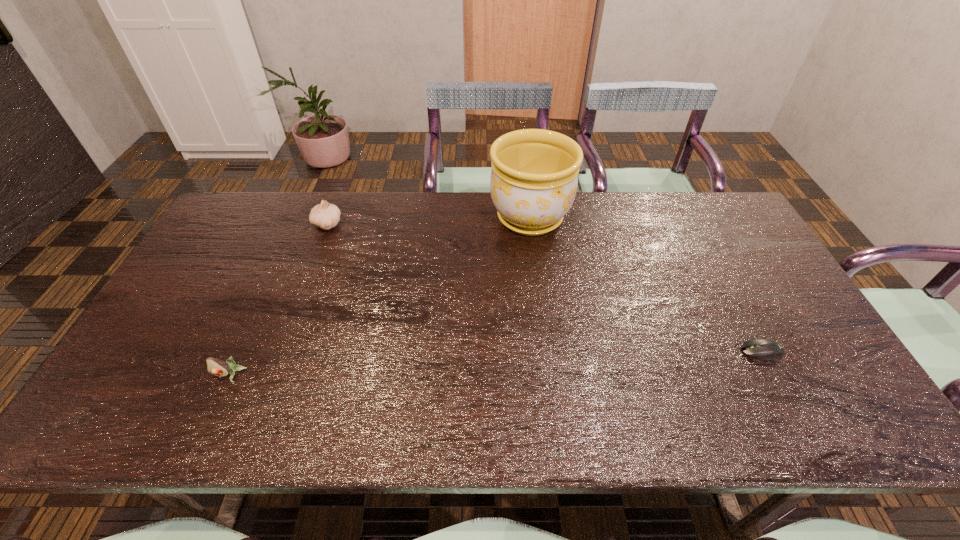
This screenshot has width=960, height=540. What are the coordinates of `the second object from right to left` in the screenshot? It's located at (534, 177).

Locate an element on the screen. flowerpot is located at coordinates (534, 177).

Locate an element on the screen. The height and width of the screenshot is (540, 960). garlic is located at coordinates (325, 215).

Image resolution: width=960 pixels, height=540 pixels. I want to click on the nearest object, so click(x=216, y=367).

You are a GUI agent. You are given a task and a screenshot of the screen. Output one action in this format:
    pyautogui.click(x=<x>, y=<y>)
    Task: Click on the leftmost object
    The image size is (960, 540).
    Given the screenshot: What is the action you would take?
    pyautogui.click(x=216, y=367)

Locate an element on the screen. the rightmost object is located at coordinates (764, 349).

At what (x,y) coordinates should I click in order to perform the action: click on the shortest object. Please return your answer as a coordinate pair (x, y). Image resolution: width=960 pixels, height=540 pixels. Looking at the image, I should click on (764, 349).

Where is `vacant region located 0.360m on the left of the third object from left to right`? The height and width of the screenshot is (540, 960). vacant region located 0.360m on the left of the third object from left to right is located at coordinates 381,218.

Find the location of `vacant space located 0.250m on the right of the garlic`. vacant space located 0.250m on the right of the garlic is located at coordinates (419, 225).

Locate an element on the screen. The height and width of the screenshot is (540, 960). vacant space located on the seed side of the avocado is located at coordinates (208, 423).